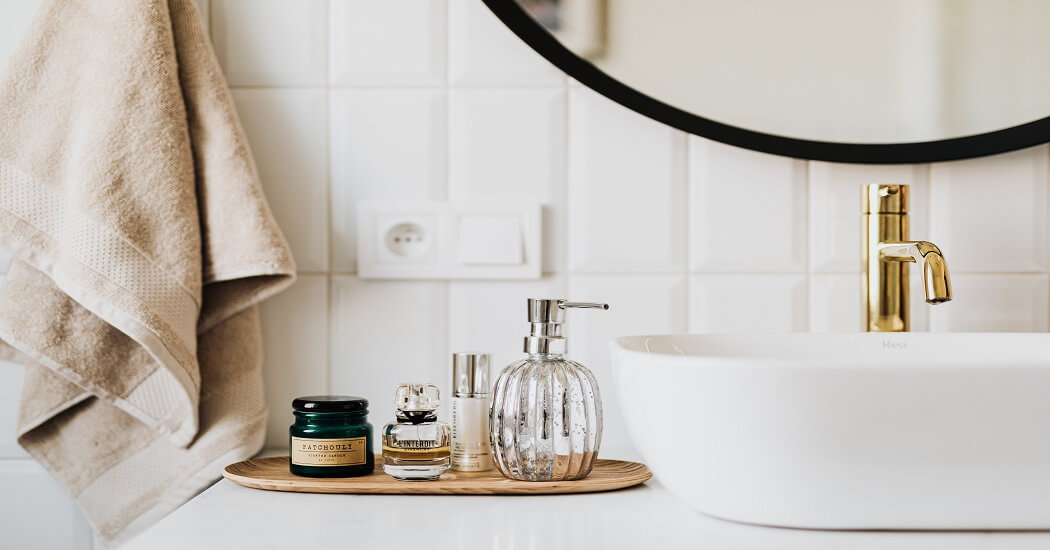
At what (x,y) coordinates should I click in order to perform the action: click on outlet. Please return your answer as a coordinate pair (x, y). The image size is (1050, 550). Looking at the image, I should click on (408, 236).